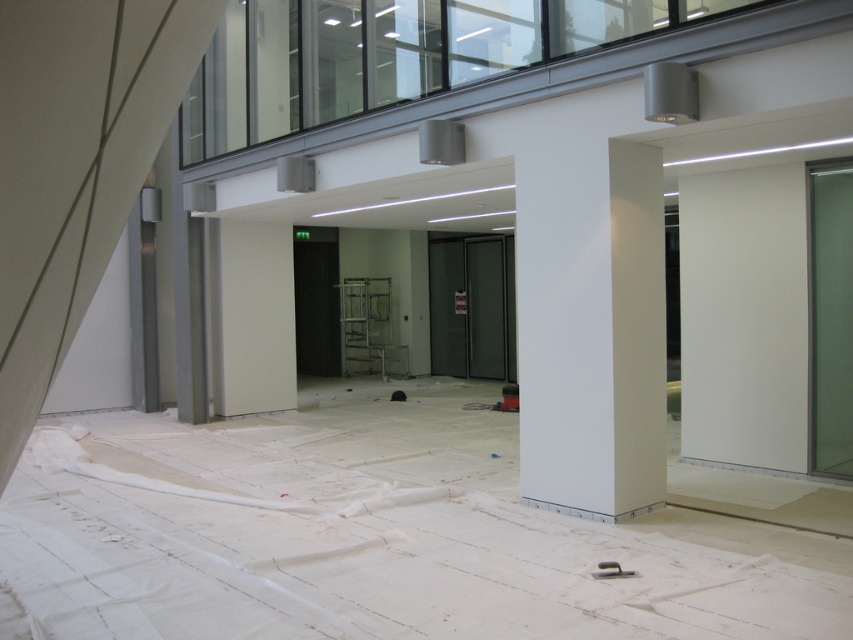
Question: Estimate the real-world distances between objects in this image. Which object is farther from the metallic silver ladder at center?

Choices:
 (A) green frosted glass door at right
 (B) white smooth column at center
 (C) transparent glass door at center

Answer: (A)

Question: Which point is farther from the camera taking this photo?

Choices:
 (A) (451, 324)
 (B) (837, 451)
 (C) (355, 285)
 (D) (645, 298)

Answer: (C)

Question: In this image, where is green frosted glass door at right located relative to metallic silver ladder at center?

Choices:
 (A) right
 (B) left

Answer: (A)

Question: Does green frosted glass door at right have a smaller size compared to metallic silver ladder at center?

Choices:
 (A) yes
 (B) no

Answer: (A)

Question: Which point is farther to the camera?

Choices:
 (A) metallic silver ladder at center
 (B) white smooth column at center
 (C) transparent glass door at center
 (D) green frosted glass door at right

Answer: (A)

Question: In this image, where is transparent glass door at center located relative to metallic silver ladder at center?

Choices:
 (A) left
 (B) right

Answer: (B)